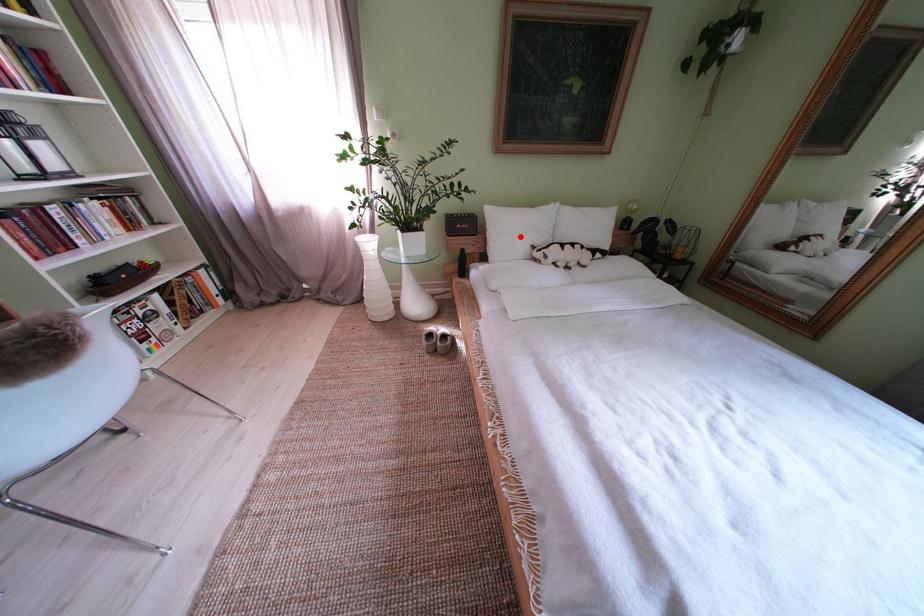
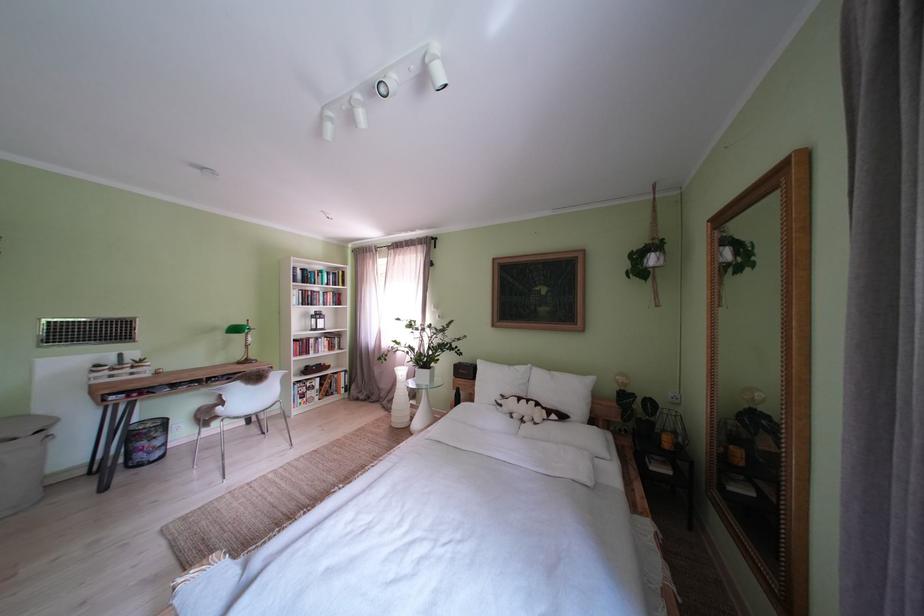
In the second image, find the point that corresponds to the highlighted location in the first image.

(500, 386)